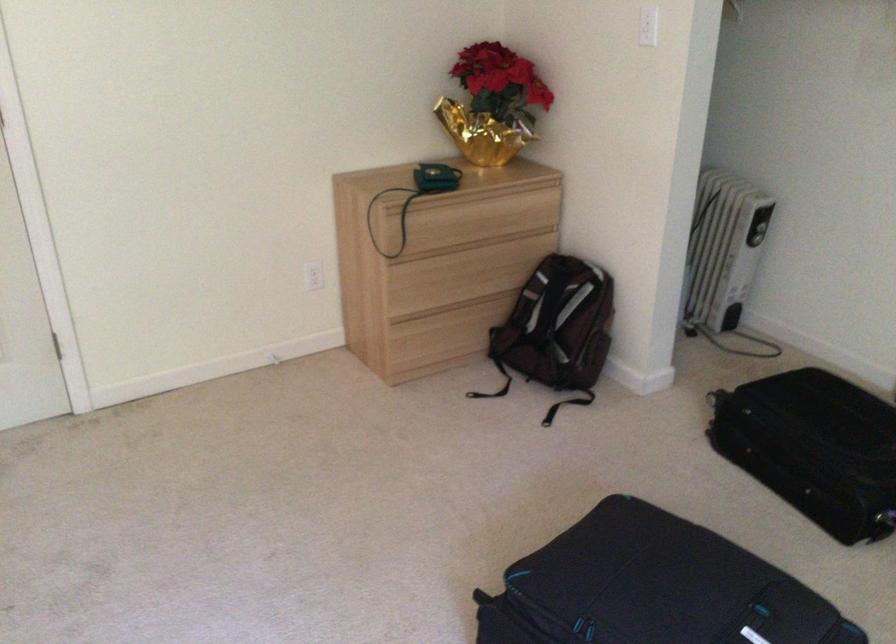
You are a GUI agent. You are given a task and a screenshot of the screen. Output one action in this format:
    pyautogui.click(x=<x>, y=<y>)
    Task: Click on the heater control dial
    The width and height of the screenshot is (896, 644).
    Given the screenshot: What is the action you would take?
    (757, 227)